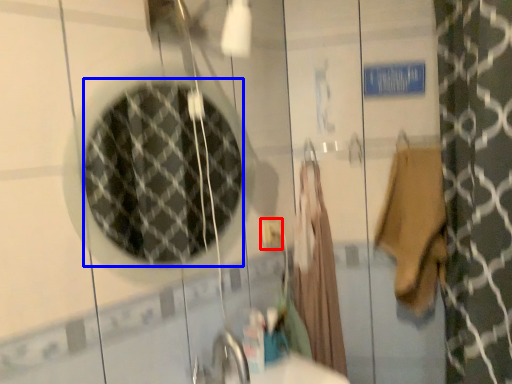
Question: Which object is further to the camera taking this photo, electric outlet (highlighted by a red box) or mirror (highlighted by a blue box)?

Choices:
 (A) electric outlet
 (B) mirror

Answer: (A)